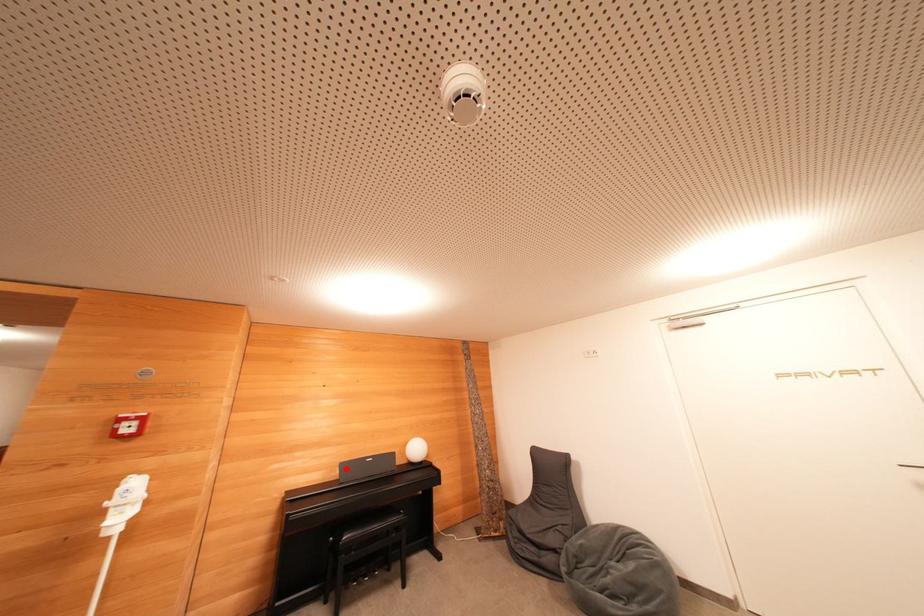
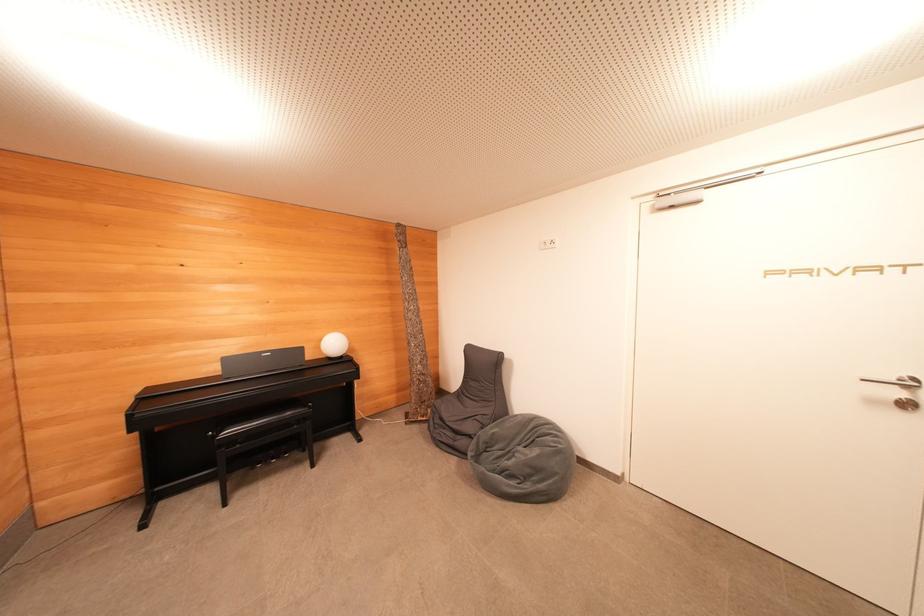
In the second image, find the point that corresponds to the highlighted location in the first image.

(229, 363)